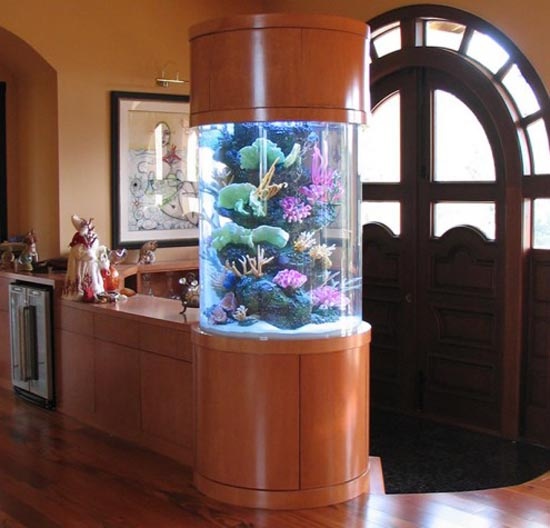
Locate an element on the screen. fish tank is located at coordinates (302, 316).